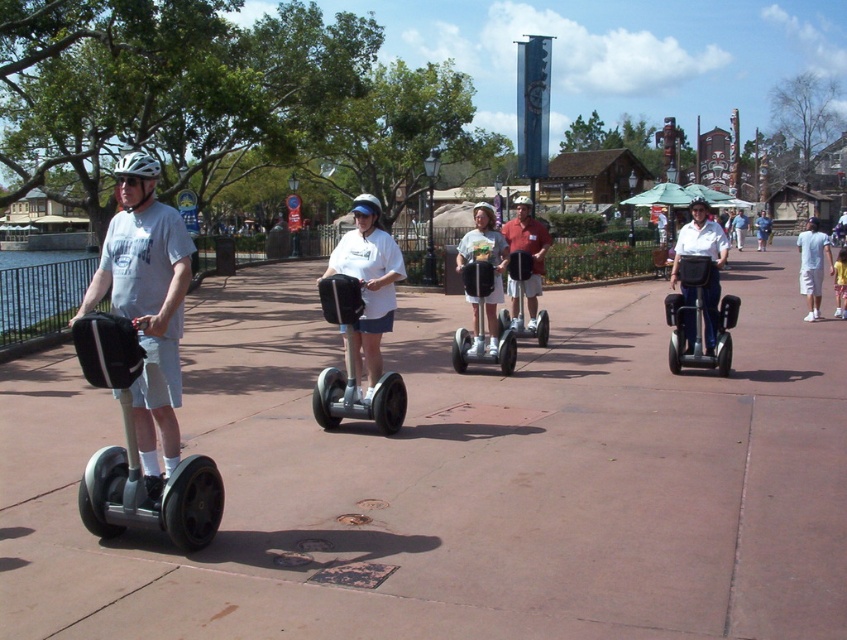
You are a safety inspector checking the Segway riders. According to the image, is the matte white helmet at center properly positioned relative to the denim shorts at center?

The matte white helmet at center is below denim shorts at center, which means it is not properly positioned as helmets should be worn on the head above the rider.

You are a tour guide leading a group on Segways. You notice a matte gray helmet at left and a black rubber segway at center. Which object is wider from your perspective?

The matte gray helmet at left is wider than the black rubber segway at center according to the description.